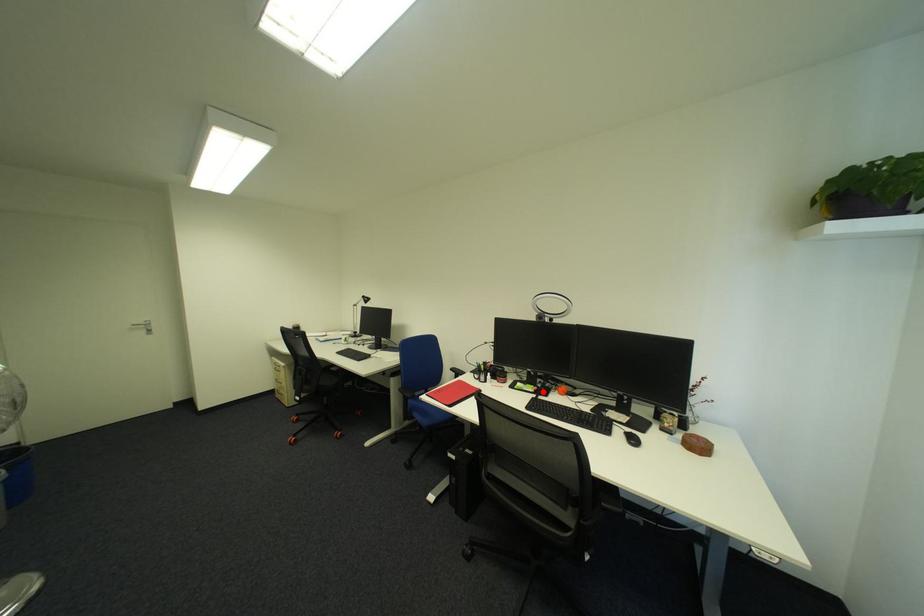
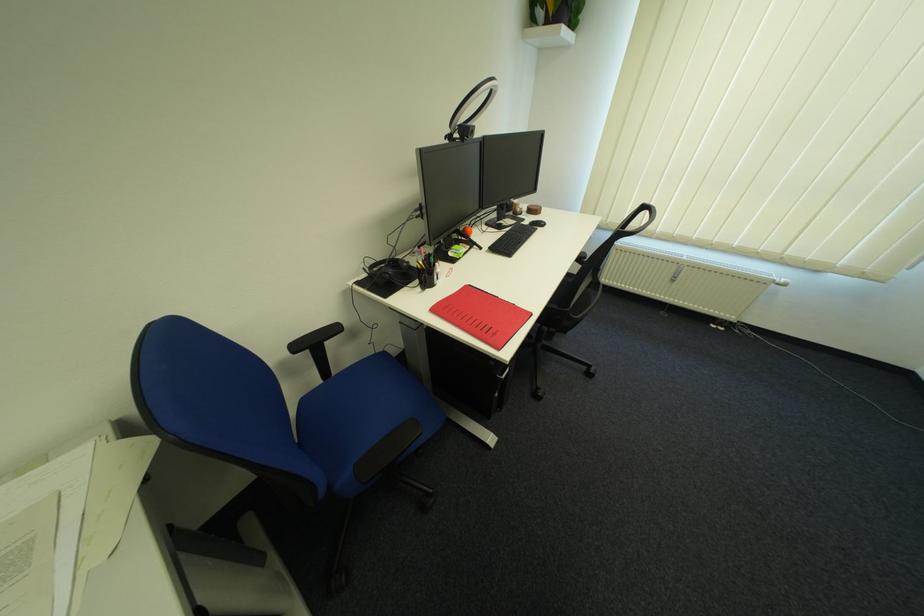
Locate, in the second image, the point that corresponds to the highlighted location in the first image.

(479, 248)